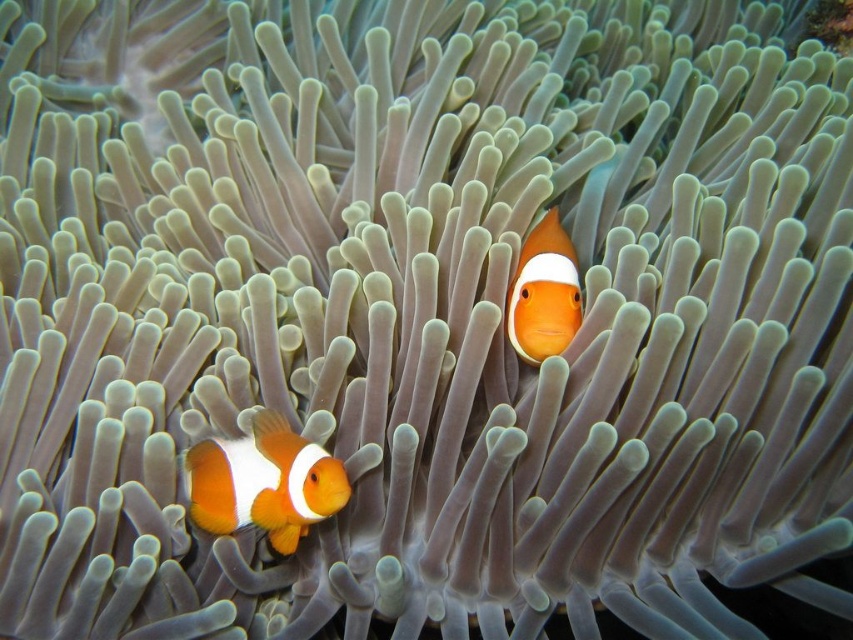
How far apart are orange matte clownfish at lower left and orange matte clownfish at center?

The distance of orange matte clownfish at lower left from orange matte clownfish at center is 23.28 inches.

Based on the photo, can you confirm if orange matte clownfish at lower left is positioned to the left of orange matte clownfish at center?

Indeed, orange matte clownfish at lower left is positioned on the left side of orange matte clownfish at center.

Is point (202, 448) positioned in front of point (550, 224)?

Yes, point (202, 448) is closer to viewer.

Locate an element on the screen. orange matte clownfish at lower left is located at coordinates (264, 483).